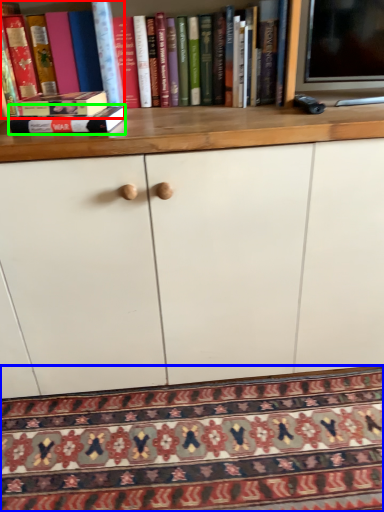
Question: Considering the real-world distances, which object is farthest from book (highlighted by a red box)? mat (highlighted by a blue box) or book (highlighted by a green box)?

Choices:
 (A) mat
 (B) book

Answer: (A)